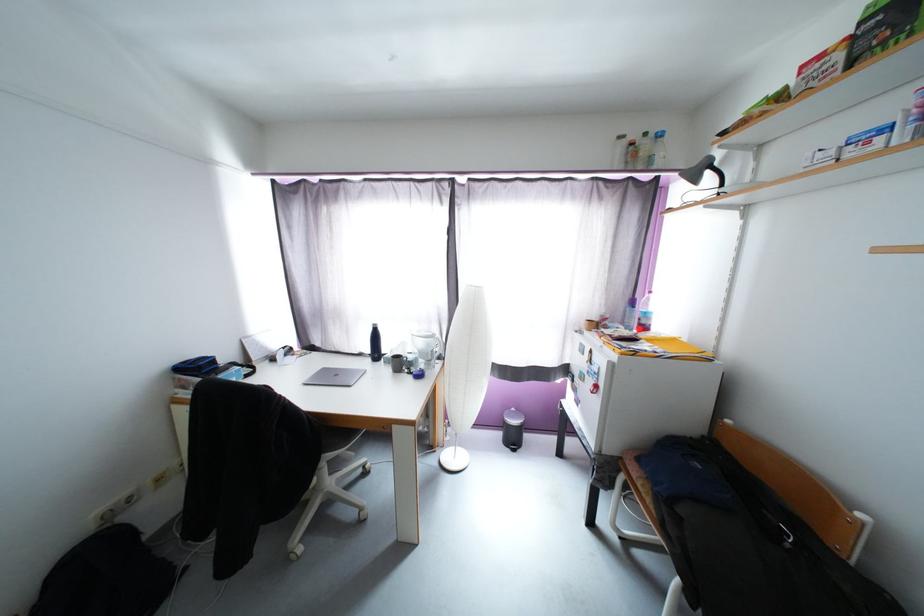
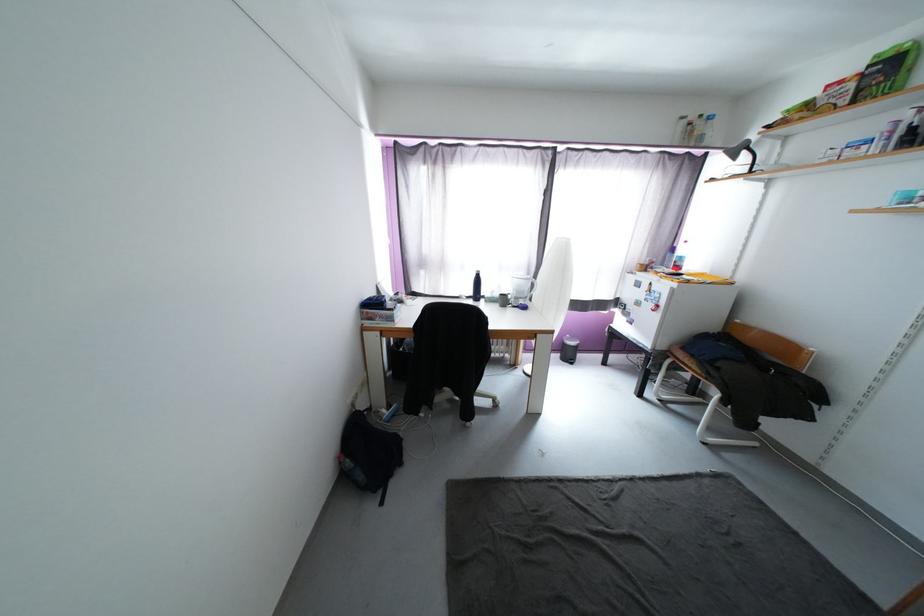
Find the pixel in the second image that matches (x=713, y=174) in the first image.

(749, 154)